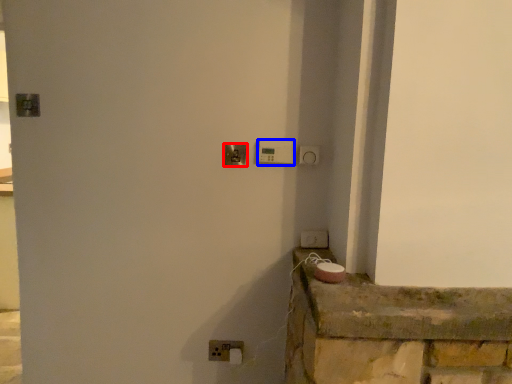
Question: Which object is closer to the camera taking this photo, door handle (highlighted by a red box) or light switch (highlighted by a blue box)?

Choices:
 (A) door handle
 (B) light switch

Answer: (B)